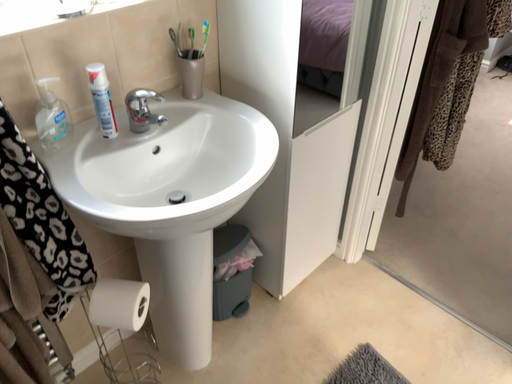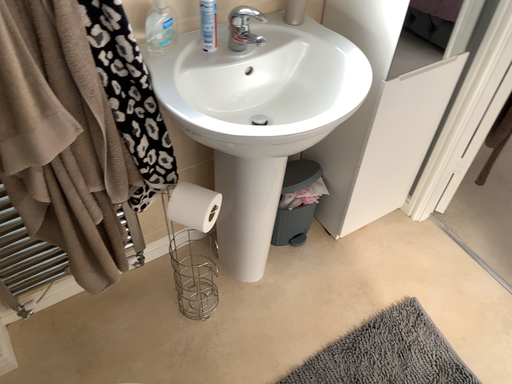
Question: Which way did the camera rotate in the video?

Choices:
 (A) rotated right
 (B) rotated left

Answer: (B)